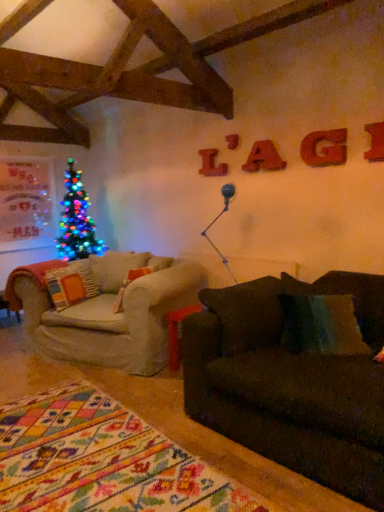
This screenshot has width=384, height=512. Find the location of `matte red letter at upper center, the 3th letter in the right-to-left sequence`. matte red letter at upper center, the 3th letter in the right-to-left sequence is located at coordinates (263, 158).

At what (x,y) coordinates should I click in order to perform the action: click on red wood letter at upper center, placed as the 4th letter when sorted from front to back. Please return your answer as a coordinate pair (x, y). Image resolution: width=384 pixels, height=512 pixels. Looking at the image, I should click on click(x=211, y=164).

The width and height of the screenshot is (384, 512). Describe the element at coordinates (324, 148) in the screenshot. I see `matte orange letter g at upper right, placed as the 3th letter when sorted from back to front` at that location.

In the scene shown: Measure the distance between point (376, 159) and camera.

The distance of point (376, 159) from camera is 9.21 feet.

Find the location of a particular element. Image resolution: width=384 pixels, height=512 pixels. orange fabric pillow at left is located at coordinates (71, 284).

Which of these two, metallic red letter at upper right, marked as the fourth letter in a back-to-front arrangement, or red wood letter at upper center, placed as the 4th letter when sorted from front to back, stands shorter?

metallic red letter at upper right, marked as the fourth letter in a back-to-front arrangement.

Could you measure the distance between metallic red letter at upper right, the 1th letter from the front, and red wood letter at upper center, placed as the 4th letter when sorted from front to back?

metallic red letter at upper right, the 1th letter from the front, and red wood letter at upper center, placed as the 4th letter when sorted from front to back, are 1.39 meters apart from each other.

Is metallic red letter at upper right, the 1th letter from the front, to the left or to the right of red wood letter at upper center, positioned as the 4th letter in right-to-left order, in the image?

From the image, it's evident that metallic red letter at upper right, the 1th letter from the front, is to the right of red wood letter at upper center, positioned as the 4th letter in right-to-left order.

Does metallic red letter at upper right, marked as the fourth letter in a back-to-front arrangement, have a lesser width compared to red wood letter at upper center, which is the 1th letter in left-to-right order?

Incorrect, the width of metallic red letter at upper right, marked as the fourth letter in a back-to-front arrangement, is not less than that of red wood letter at upper center, which is the 1th letter in left-to-right order.

Is orange fabric pillow at left located outside metallic red letter at upper right, positioned as the first letter in right-to-left order?

orange fabric pillow at left is positioned outside metallic red letter at upper right, positioned as the first letter in right-to-left order.

Looking at their sizes, would you say orange fabric pillow at left is wider or thinner than metallic red letter at upper right, acting as the 4th letter starting from the left?

orange fabric pillow at left is wider than metallic red letter at upper right, acting as the 4th letter starting from the left.

How far apart are orange fabric pillow at left and metallic red letter at upper right, positioned as the first letter in right-to-left order?

A distance of 8.23 feet exists between orange fabric pillow at left and metallic red letter at upper right, positioned as the first letter in right-to-left order.

From the image's perspective, is metallic red letter at upper right, acting as the 4th letter starting from the left, over matte orange letter g at upper right, arranged as the 2th letter when viewed from the front?

No.

Considering the sizes of metallic red letter at upper right, acting as the 4th letter starting from the left, and matte orange letter g at upper right, placed as the 3th letter when sorted from back to front, in the image, is metallic red letter at upper right, acting as the 4th letter starting from the left, wider or thinner than matte orange letter g at upper right, placed as the 3th letter when sorted from back to front,?

Clearly, metallic red letter at upper right, acting as the 4th letter starting from the left, has less width compared to matte orange letter g at upper right, placed as the 3th letter when sorted from back to front.

Is metallic red letter at upper right, positioned as the first letter in right-to-left order, beside matte orange letter g at upper right, arranged as the 2th letter when viewed from the front?

There is a gap between metallic red letter at upper right, positioned as the first letter in right-to-left order, and matte orange letter g at upper right, arranged as the 2th letter when viewed from the front.

Is metallic red letter at upper right, the 1th letter from the front, inside or outside of matte orange letter g at upper right, the third letter positioned from the left?

metallic red letter at upper right, the 1th letter from the front, exists outside the volume of matte orange letter g at upper right, the third letter positioned from the left.

Based on the photo, could you measure the distance between matte red letter at upper center, the 3th letter in the front-to-back sequence, and metallic red letter at upper right, marked as the fourth letter in a back-to-front arrangement?

30.84 inches.

Considering the positions of point (274, 150) and point (378, 154), is point (274, 150) closer or farther from the camera than point (378, 154)?

Point (274, 150) appears to be farther away from the viewer than point (378, 154).

Relative to metallic red letter at upper right, acting as the 4th letter starting from the left, is matte red letter at upper center, positioned as the 2th letter in back-to-front order, in front or behind?

matte red letter at upper center, positioned as the 2th letter in back-to-front order, is behind metallic red letter at upper right, acting as the 4th letter starting from the left.

From the image's perspective, would you say matte red letter at upper center, the second letter from the left, is shown under metallic red letter at upper right, marked as the fourth letter in a back-to-front arrangement?

Actually, matte red letter at upper center, the second letter from the left, appears above metallic red letter at upper right, marked as the fourth letter in a back-to-front arrangement, in the image.

From a real-world perspective, which object stands above the other?

red wood letter at upper center, positioned as the 4th letter in right-to-left order, from a real-world perspective.

Considering the relative positions of orange fabric pillow at left and red wood letter at upper center, which is the 1th letter in left-to-right order, in the image provided, is orange fabric pillow at left to the left or to the right of red wood letter at upper center, which is the 1th letter in left-to-right order,?

orange fabric pillow at left is to the left of red wood letter at upper center, which is the 1th letter in left-to-right order.

Measure the distance from orange fabric pillow at left to red wood letter at upper center, which is the 1th letter in left-to-right order.

A distance of 1.56 meters exists between orange fabric pillow at left and red wood letter at upper center, which is the 1th letter in left-to-right order.

Would you consider matte red letter at upper center, the 3th letter in the right-to-left sequence, to be distant from red wood letter at upper center, which is the 1th letter in left-to-right order?

That's not correct — matte red letter at upper center, the 3th letter in the right-to-left sequence, is a little close to red wood letter at upper center, which is the 1th letter in left-to-right order.

Is the position of matte red letter at upper center, the 3th letter in the front-to-back sequence, less distant than that of red wood letter at upper center, positioned as the 4th letter in right-to-left order?

Yes, matte red letter at upper center, the 3th letter in the front-to-back sequence, is closer to the viewer.

Based on the photo, who is shorter, matte red letter at upper center, the 3th letter in the right-to-left sequence, or red wood letter at upper center, the first letter when ordered from back to front?

matte red letter at upper center, the 3th letter in the right-to-left sequence, is shorter.

From a real-world perspective, which letter is the 1st one above the matte red letter at upper center, positioned as the 2th letter in back-to-front order? Please provide its 2D coordinates.

[(211, 164)]

Where is `letter that is the 4th one when counting rightward from the orange fabric pillow at left`? The image size is (384, 512). letter that is the 4th one when counting rightward from the orange fabric pillow at left is located at coordinates (375, 142).

Based on the photo, who is shorter, metallic red letter at upper right, the 1th letter from the front, or orange fabric pillow at left?

metallic red letter at upper right, the 1th letter from the front, is shorter.

From the picture: Which object is closer to the camera, metallic red letter at upper right, positioned as the first letter in right-to-left order, or orange fabric pillow at left?

metallic red letter at upper right, positioned as the first letter in right-to-left order, is in front.

You are a GUI agent. You are given a task and a screenshot of the screen. Output one action in this format:
    pyautogui.click(x=<x>, y=<y>)
    Task: Click on the letter that is the 3rd one when counting upward from the metallic red letter at upper right, marked as the fourth letter in a back-to-front arrangement (from the image's perspective)
    This screenshot has height=512, width=384.
    Given the screenshot: What is the action you would take?
    pyautogui.click(x=211, y=164)

Identify the location of pillow lying on the left of metallic red letter at upper right, acting as the 4th letter starting from the left. (71, 284).

Which object lies further to the anchor point matte red letter at upper center, the second letter from the left, metallic red letter at upper right, the 1th letter from the front, or orange fabric pillow at left?

orange fabric pillow at left is further to matte red letter at upper center, the second letter from the left.

Estimate the real-world distances between objects in this image. Which object is closer to red wood letter at upper center, positioned as the 4th letter in right-to-left order, metallic red letter at upper right, positioned as the first letter in right-to-left order, or matte orange letter g at upper right, which is counted as the second letter, starting from the right?

matte orange letter g at upper right, which is counted as the second letter, starting from the right, is positioned closer to the anchor red wood letter at upper center, positioned as the 4th letter in right-to-left order.

Looking at the image, which one is located further to orange fabric pillow at left, matte red letter at upper center, positioned as the 2th letter in back-to-front order, or matte orange letter g at upper right, placed as the 3th letter when sorted from back to front?

matte orange letter g at upper right, placed as the 3th letter when sorted from back to front, is further to orange fabric pillow at left.

Estimate the real-world distances between objects in this image. Which object is further from matte red letter at upper center, the 3th letter in the right-to-left sequence, orange fabric pillow at left or metallic red letter at upper right, marked as the fourth letter in a back-to-front arrangement?

Based on the image, orange fabric pillow at left appears to be further to matte red letter at upper center, the 3th letter in the right-to-left sequence.

Based on their spatial positions, is orange fabric pillow at left or matte red letter at upper center, the 3th letter in the front-to-back sequence, closer to matte orange letter g at upper right, the third letter positioned from the left?

Among the two, matte red letter at upper center, the 3th letter in the front-to-back sequence, is located nearer to matte orange letter g at upper right, the third letter positioned from the left.

Which object lies nearer to the anchor point matte red letter at upper center, the second letter from the left, matte orange letter g at upper right, arranged as the 2th letter when viewed from the front, or orange fabric pillow at left?

matte orange letter g at upper right, arranged as the 2th letter when viewed from the front, is positioned closer to the anchor matte red letter at upper center, the second letter from the left.

From the image, which object appears to be nearer to orange fabric pillow at left, metallic red letter at upper right, marked as the fourth letter in a back-to-front arrangement, or red wood letter at upper center, positioned as the 4th letter in right-to-left order?

red wood letter at upper center, positioned as the 4th letter in right-to-left order, lies closer to orange fabric pillow at left than the other object.

Looking at the image, which one is located further to matte red letter at upper center, the second letter from the left, matte orange letter g at upper right, arranged as the 2th letter when viewed from the front, or red wood letter at upper center, the first letter when ordered from back to front?

red wood letter at upper center, the first letter when ordered from back to front, lies further to matte red letter at upper center, the second letter from the left, than the other object.

Where is `letter between matte orange letter g at upper right, which is counted as the second letter, starting from the right, and red wood letter at upper center, placed as the 4th letter when sorted from front to back, from front to back`? letter between matte orange letter g at upper right, which is counted as the second letter, starting from the right, and red wood letter at upper center, placed as the 4th letter when sorted from front to back, from front to back is located at coordinates (263, 158).

Where is `letter between orange fabric pillow at left and matte red letter at upper center, the 3th letter in the front-to-back sequence`? letter between orange fabric pillow at left and matte red letter at upper center, the 3th letter in the front-to-back sequence is located at coordinates (211, 164).

Where is `letter between metallic red letter at upper right, acting as the 4th letter starting from the left, and matte red letter at upper center, the second letter from the left, along the z-axis`? This screenshot has width=384, height=512. letter between metallic red letter at upper right, acting as the 4th letter starting from the left, and matte red letter at upper center, the second letter from the left, along the z-axis is located at coordinates (324, 148).